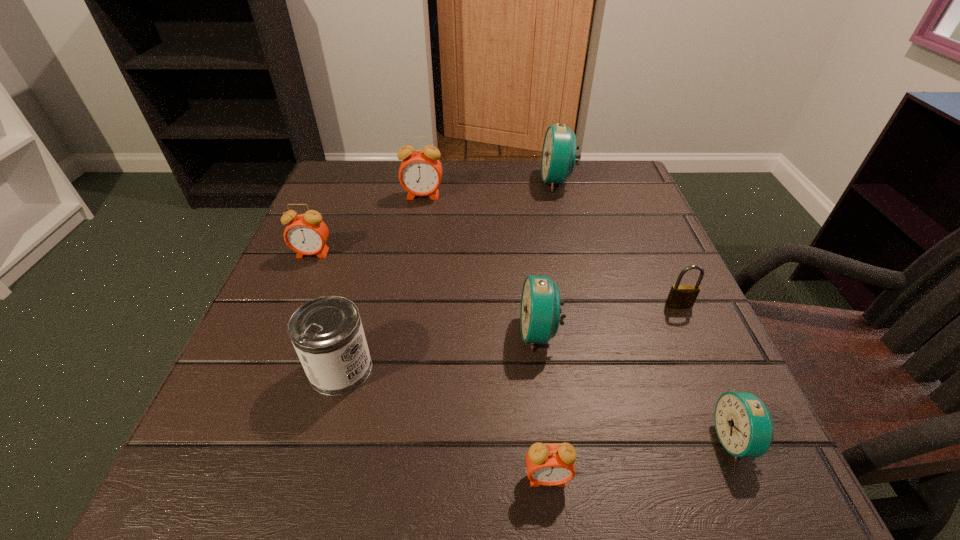
Image resolution: width=960 pixels, height=540 pixels. Find the location of `the nearest blue alarm clock`. the nearest blue alarm clock is located at coordinates (744, 426).

Identify the location of the smallest blue alarm clock. (744, 426).

Find the location of `the nearest pink alarm clock`. the nearest pink alarm clock is located at coordinates (549, 464).

Where is `the rightmost pink alarm clock`? This screenshot has width=960, height=540. the rightmost pink alarm clock is located at coordinates (549, 464).

The image size is (960, 540). I want to click on free space located on the front-facing side of the farthest blue alarm clock, so click(443, 181).

The height and width of the screenshot is (540, 960). In order to click on vacant region located on the front-facing side of the farthest blue alarm clock in this screenshot , I will do `click(486, 181)`.

You are a GUI agent. You are given a task and a screenshot of the screen. Output one action in this format:
    pyautogui.click(x=<x>, y=<y>)
    Task: Click on the free point located 0.160m on the front-facing side of the farthest blue alarm clock
    The image size is (960, 540).
    Given the screenshot: What is the action you would take?
    pyautogui.click(x=478, y=181)

Identify the location of vacant area located 0.140m on the face of the farthest pink alarm clock. The height and width of the screenshot is (540, 960). tap(416, 237).

Where is `vacant space positioned on the front-facing side of the fourth farthest alarm clock`? The image size is (960, 540). vacant space positioned on the front-facing side of the fourth farthest alarm clock is located at coordinates (363, 333).

Where is `vacant area located 0.170m on the front-facing side of the fourth farthest alarm clock`? This screenshot has height=540, width=960. vacant area located 0.170m on the front-facing side of the fourth farthest alarm clock is located at coordinates (420, 333).